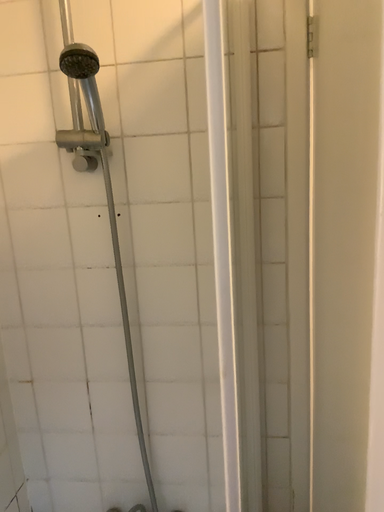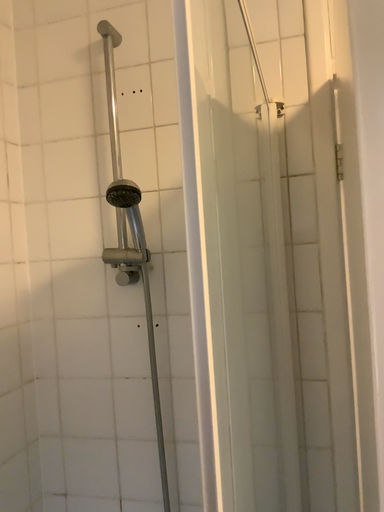
Question: How did the camera likely rotate when shooting the video?

Choices:
 (A) rotated upward
 (B) rotated downward

Answer: (A)